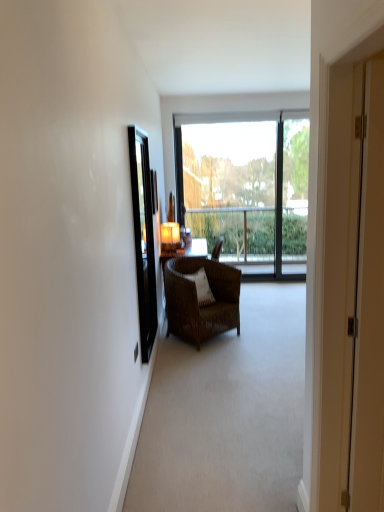
Measure the distance between transparent glass window at center and camera.

They are 5.48 meters apart.

In order to click on transparent glass window at center in this screenshot , I will do `click(245, 187)`.

What do you see at coordinates (340, 278) in the screenshot? I see `white wood screen door at right, the 2th screen door in the left-to-right sequence` at bounding box center [340, 278].

The image size is (384, 512). Identify the location of matte glass lampshade at upper center. (170, 237).

I want to click on black glass screen door at left, which appears as the second screen door when viewed from the front, so click(x=143, y=238).

Where is `transparent glass window at center`? The image size is (384, 512). transparent glass window at center is located at coordinates (245, 187).

How different are the orientations of white wood screen door at right, the second screen door when ordered from back to front, and transparent glass window at center in degrees?

The angle between the facing direction of white wood screen door at right, the second screen door when ordered from back to front, and the facing direction of transparent glass window at center is 90.3 degrees.

Consider the image. From a real-world perspective, which is physically below, white wood screen door at right, the 2th screen door in the left-to-right sequence, or transparent glass window at center?

From a 3D spatial view, transparent glass window at center is below.

From the image's perspective, is white wood screen door at right, the second screen door when ordered from back to front, beneath transparent glass window at center?

Yes, from the image's perspective, white wood screen door at right, the second screen door when ordered from back to front, is below transparent glass window at center.

Based on the photo, which object is wider, brown wicker chair at center or white wood screen door at right, the 2th screen door in the left-to-right sequence?

With larger width is brown wicker chair at center.

Is brown wicker chair at center oriented towards white wood screen door at right, the 2th screen door in the left-to-right sequence?

No, brown wicker chair at center is not turned towards white wood screen door at right, the 2th screen door in the left-to-right sequence.

Based on the photo, would you say brown wicker chair at center contains white wood screen door at right, the 2th screen door in the left-to-right sequence?

Actually, white wood screen door at right, the 2th screen door in the left-to-right sequence, is outside brown wicker chair at center.

Which object is more forward, brown wicker chair at center or white wood screen door at right, the second screen door when ordered from back to front?

white wood screen door at right, the second screen door when ordered from back to front, is in front.

Is matte glass lampshade at upper center bigger or smaller than black glass screen door at left, placed as the first screen door when sorted from back to front?

Clearly, matte glass lampshade at upper center is smaller in size than black glass screen door at left, placed as the first screen door when sorted from back to front.

In the scene shown: From a real-world perspective, who is located higher, matte glass lampshade at upper center or black glass screen door at left, the 2th screen door viewed from the right?

black glass screen door at left, the 2th screen door viewed from the right, from a real-world perspective.

Is point (168, 252) farther from camera compared to point (151, 331)?

Yes, point (168, 252) is farther from viewer.

Can you confirm if matte glass lampshade at upper center is positioned to the right of black glass screen door at left, which is the first screen door in left-to-right order?

Yes, matte glass lampshade at upper center is to the right of black glass screen door at left, which is the first screen door in left-to-right order.

Is black glass screen door at left, which appears as the second screen door when viewed from the front, facing towards brown wicker chair at center?

No.

From a real-world perspective, is black glass screen door at left, the 2th screen door viewed from the right, beneath brown wicker chair at center?

Actually, black glass screen door at left, the 2th screen door viewed from the right, is physically above brown wicker chair at center in the real world.

At what (x,y) coordinates should I click in order to perform the action: click on chair that is below the black glass screen door at left, which is the first screen door in left-to-right order (from the image's perspective). Please return your answer as a coordinate pair (x, y). This screenshot has width=384, height=512. Looking at the image, I should click on (197, 298).

Is brown wicker chair at center a part of black glass screen door at left, which is the first screen door in left-to-right order?

Definitely not — brown wicker chair at center is not inside black glass screen door at left, which is the first screen door in left-to-right order.

Looking at this image, can you confirm if white textured pillow at center is bigger than white wood screen door at right, the 2th screen door in the left-to-right sequence?

Actually, white textured pillow at center might be smaller than white wood screen door at right, the 2th screen door in the left-to-right sequence.

From the image's perspective, is white textured pillow at center located above white wood screen door at right, which is counted as the first screen door, starting from the front?

Incorrect, from the image's perspective, white textured pillow at center is lower than white wood screen door at right, which is counted as the first screen door, starting from the front.

Which is correct: white textured pillow at center is inside white wood screen door at right, the second screen door when ordered from back to front, or outside of it?

white textured pillow at center is located beyond the bounds of white wood screen door at right, the second screen door when ordered from back to front.

Considering the positions of points (235, 326) and (195, 281), is point (235, 326) farther from camera compared to point (195, 281)?

Yes, point (235, 326) is farther from viewer.

Which is behind, brown wicker chair at center or white textured pillow at center?

white textured pillow at center is further away from the camera.

The image size is (384, 512). I want to click on pillow that is behind the brown wicker chair at center, so point(202,287).

In terms of height, does brown wicker chair at center look taller or shorter compared to white textured pillow at center?

Considering their sizes, brown wicker chair at center has more height than white textured pillow at center.

Is matte glass lampshade at upper center oriented towards transparent glass window at center?

Yes.

Is point (166, 224) farther from viewer compared to point (302, 252)?

No.

Locate an element on the screen. The image size is (384, 512). lamp in front of the transparent glass window at center is located at coordinates (170, 237).

From the image's perspective, starting from the transparent glass window at center, which screen door is the 2nd one below? Please provide its 2D coordinates.

[(340, 278)]

From a real-world perspective, which screen door is the 1st one above the brown wicker chair at center? Please provide its 2D coordinates.

[(340, 278)]

When comparing their distances from white wood screen door at right, which is counted as the first screen door, starting from the front, does white textured pillow at center or matte glass lampshade at upper center seem further?

Based on the image, matte glass lampshade at upper center appears to be further to white wood screen door at right, which is counted as the first screen door, starting from the front.

Which object lies nearer to the anchor point white textured pillow at center, black glass screen door at left, placed as the first screen door when sorted from back to front, or white wood screen door at right, the 2th screen door in the left-to-right sequence?

black glass screen door at left, placed as the first screen door when sorted from back to front, is closer to white textured pillow at center.

Which object lies nearer to the anchor point white wood screen door at right, which is the first screen door from right to left, black glass screen door at left, which is the first screen door in left-to-right order, or brown wicker chair at center?

Among the two, black glass screen door at left, which is the first screen door in left-to-right order, is located nearer to white wood screen door at right, which is the first screen door from right to left.

Considering their positions, is transparent glass window at center positioned closer to matte glass lampshade at upper center than brown wicker chair at center?

brown wicker chair at center is positioned closer to the anchor matte glass lampshade at upper center.

Based on their spatial positions, is white textured pillow at center or black glass screen door at left, which is the first screen door in left-to-right order, closer to white wood screen door at right, the 2th screen door in the left-to-right sequence?

The object closer to white wood screen door at right, the 2th screen door in the left-to-right sequence, is black glass screen door at left, which is the first screen door in left-to-right order.

Which object lies further to the anchor point white textured pillow at center, black glass screen door at left, placed as the first screen door when sorted from back to front, or brown wicker chair at center?

black glass screen door at left, placed as the first screen door when sorted from back to front, is further to white textured pillow at center.

When comparing their distances from transparent glass window at center, does white wood screen door at right, the second screen door when ordered from back to front, or black glass screen door at left, the 2th screen door viewed from the right, seem further?

Among the two, white wood screen door at right, the second screen door when ordered from back to front, is located further to transparent glass window at center.

Which object lies further to the anchor point white textured pillow at center, transparent glass window at center or matte glass lampshade at upper center?

The object further to white textured pillow at center is transparent glass window at center.

At what (x,y) coordinates should I click in order to perform the action: click on screen door between white wood screen door at right, the second screen door when ordered from back to front, and transparent glass window at center, along the z-axis. Please return your answer as a coordinate pair (x, y). This screenshot has width=384, height=512. Looking at the image, I should click on (143, 238).

You are a GUI agent. You are given a task and a screenshot of the screen. Output one action in this format:
    pyautogui.click(x=<x>, y=<y>)
    Task: Click on the lamp positioned between black glass screen door at left, the 2th screen door viewed from the right, and transparent glass window at center from near to far
    
    Given the screenshot: What is the action you would take?
    coord(170,237)

Find the location of `screen door between white wood screen door at right, which is counted as the first screen door, starting from the front, and white textured pillow at center in the front-back direction`. screen door between white wood screen door at right, which is counted as the first screen door, starting from the front, and white textured pillow at center in the front-back direction is located at coordinates (143, 238).

What are the coordinates of `pillow between brown wicker chair at center and matte glass lampshade at upper center from front to back` in the screenshot? It's located at (202, 287).